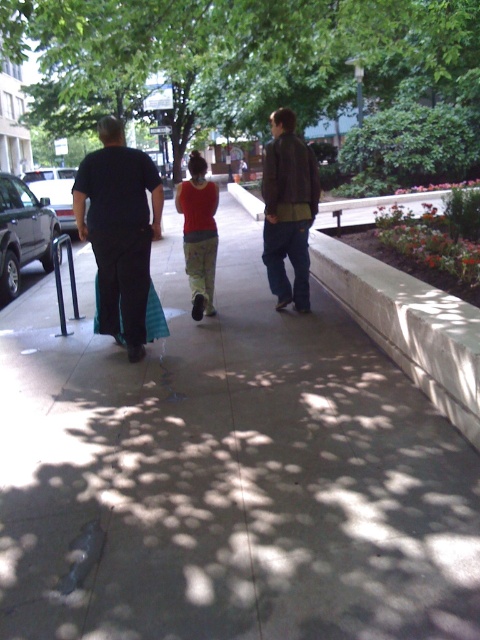
Image resolution: width=480 pixels, height=640 pixels. I want to click on gray concrete sidewalk at center, so click(x=227, y=474).

Is gray concrete sidewalk at center below dark gray pants at center?

Yes.

Between point (199, 344) and point (144, 326), which one is positioned in front?

Point (144, 326)

Locate an element on the screen. gray concrete sidewalk at center is located at coordinates (227, 474).

Who is higher up, white concrete curb at center or red cotton shirt at center?

red cotton shirt at center

Which of these two, white concrete curb at center or red cotton shirt at center, stands shorter?

red cotton shirt at center is shorter.

Is point (425, 346) positioned before point (184, 195)?

Yes, it is.

This screenshot has width=480, height=640. Identify the location of white concrete curb at center. (406, 321).

Measure the distance between white concrete curb at center and dark gray pants at center.

16.11 feet

Between white concrete curb at center and dark gray pants at center, which one is positioned lower?

dark gray pants at center is lower down.

Does point (328, 252) come in front of point (106, 150)?

No, (328, 252) is behind (106, 150).

Identify the location of white concrete curb at center. (406, 321).